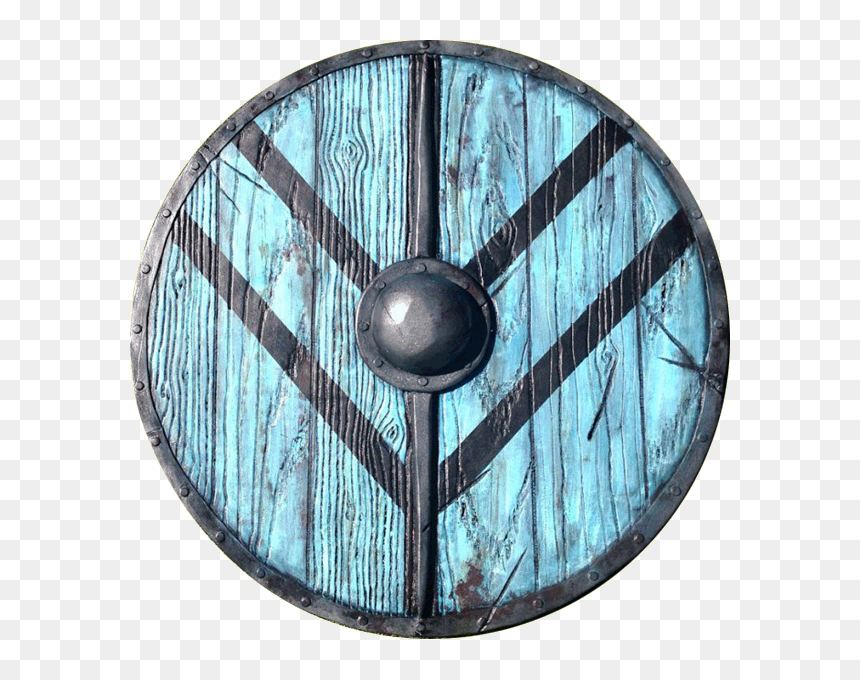
What are the coordinates of `center knob` in the screenshot? It's located at (428, 330).